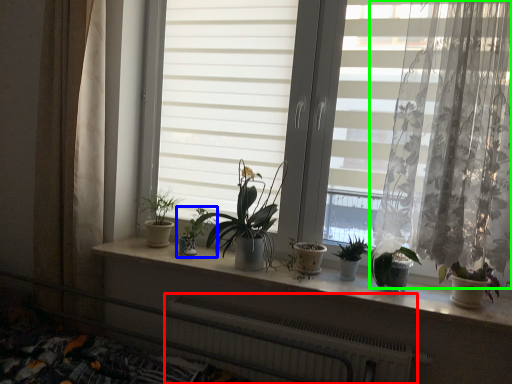
Question: Which is farther away from radiator (highlighted by a red box)? houseplant (highlighted by a blue box) or curtain (highlighted by a green box)?

Choices:
 (A) houseplant
 (B) curtain

Answer: (B)